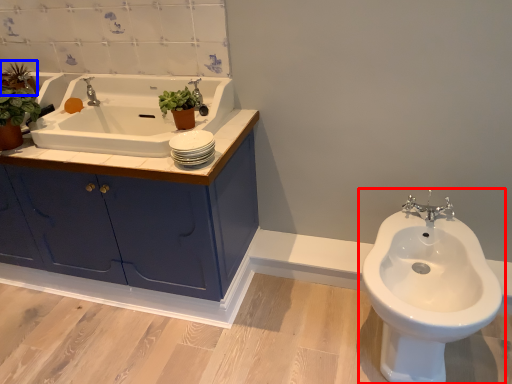
Question: Which object appears closest to the camera in this image, toilet (highlighted by a red box) or plant (highlighted by a blue box)?

Choices:
 (A) toilet
 (B) plant

Answer: (A)